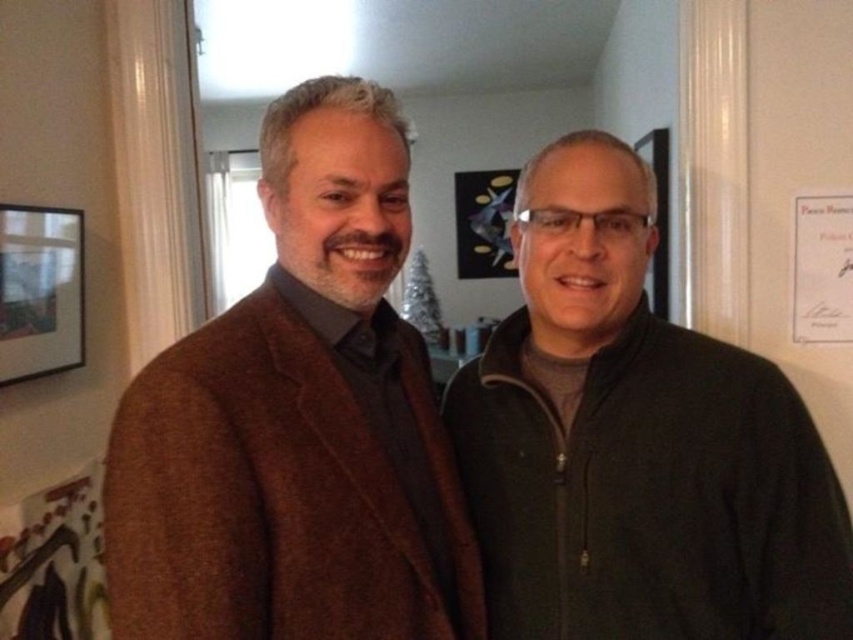
Is painted wood bulletin board at lower left to the right of black matte picture frame at upper left from the viewer's perspective?

Correct, you'll find painted wood bulletin board at lower left to the right of black matte picture frame at upper left.

Is painted wood bulletin board at lower left shorter than black matte picture frame at upper left?

Correct, painted wood bulletin board at lower left is not as tall as black matte picture frame at upper left.

Describe the element at coordinates (55, 566) in the screenshot. I see `painted wood bulletin board at lower left` at that location.

The image size is (853, 640). Find the location of `painted wood bulletin board at lower left`. painted wood bulletin board at lower left is located at coordinates (55, 566).

Does brown woolen jacket at center have a lesser width compared to dark green fleece at center?

Yes, brown woolen jacket at center is thinner than dark green fleece at center.

Based on the photo, does brown woolen jacket at center appear on the left side of dark green fleece at center?

Indeed, brown woolen jacket at center is positioned on the left side of dark green fleece at center.

Which is in front, point (195, 467) or point (616, 339)?

Point (195, 467)

This screenshot has width=853, height=640. I want to click on brown woolen jacket at center, so click(297, 420).

Between point (660, 436) and point (4, 346), which one is positioned in front?

Positioned in front is point (660, 436).

Does point (746, 360) lie behind point (38, 365)?

No, (746, 360) is in front of (38, 365).

Identify the location of dark green fleece at center. (635, 442).